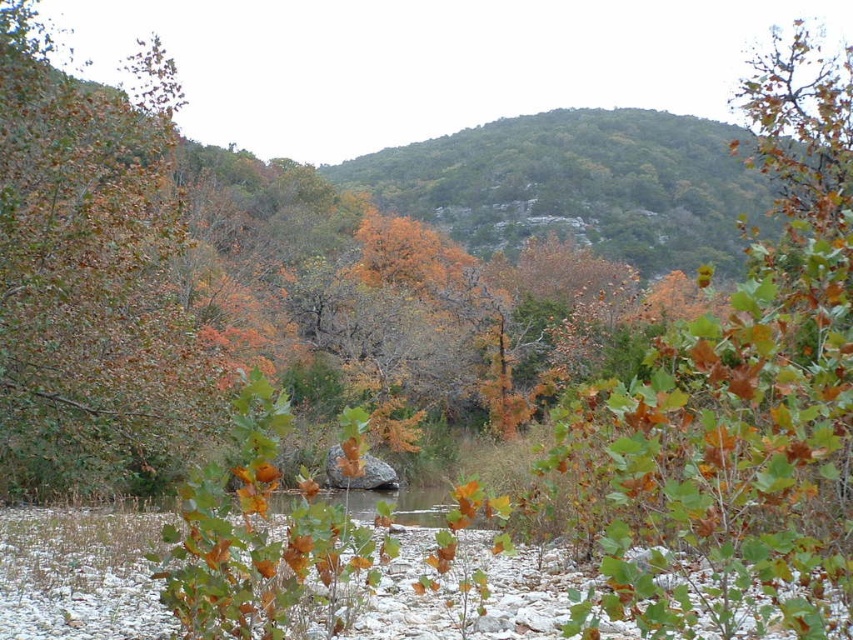
Question: Can you confirm if green matte tree at center is wider than green leafy tree at left?

Choices:
 (A) no
 (B) yes

Answer: (B)

Question: Observing the image, what is the correct spatial positioning of green matte tree at center in reference to green leafy tree at left?

Choices:
 (A) above
 (B) below

Answer: (A)

Question: Can you confirm if green matte tree at center is positioned above green leafy tree at left?

Choices:
 (A) no
 (B) yes

Answer: (B)